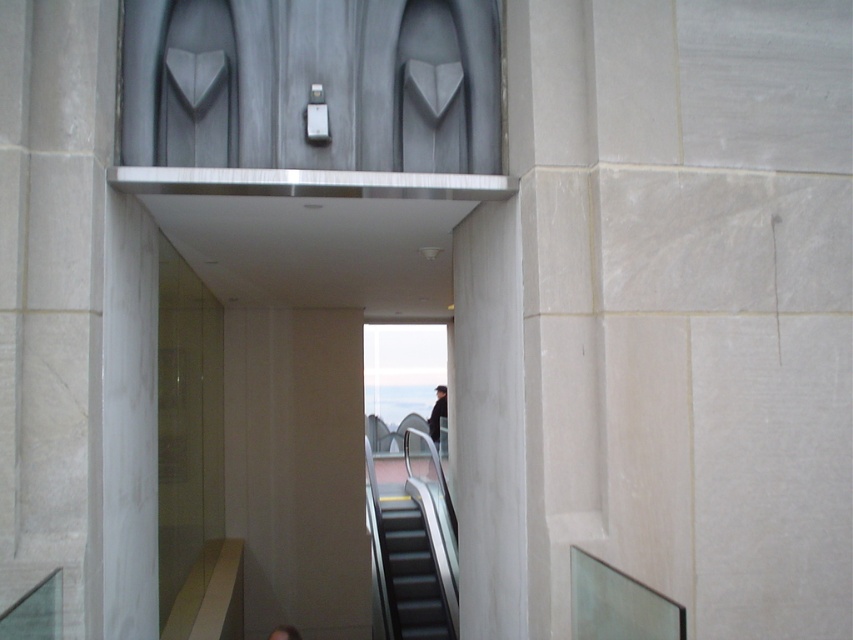
Question: Does black rubber escalator at center have a lesser width compared to black matte jacket at center?

Choices:
 (A) yes
 (B) no

Answer: (B)

Question: Which point is closer to the camera taking this photo?

Choices:
 (A) (418, 618)
 (B) (432, 419)

Answer: (A)

Question: Which of the following is the farthest from the observer?

Choices:
 (A) (397, 582)
 (B) (442, 412)

Answer: (B)

Question: Which point is closer to the camera?

Choices:
 (A) (402, 515)
 (B) (437, 417)

Answer: (A)

Question: Can you confirm if black rubber escalator at center is positioned to the left of black matte jacket at center?

Choices:
 (A) yes
 (B) no

Answer: (A)

Question: Is black rubber escalator at center thinner than black matte jacket at center?

Choices:
 (A) yes
 (B) no

Answer: (B)